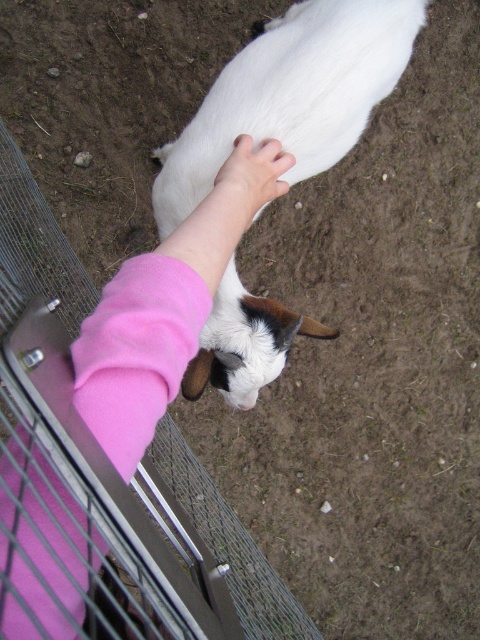
Who is positioned more to the left, pink fleece sleeve at center or pink soft hand at center?

pink fleece sleeve at center

What do you see at coordinates (146, 336) in the screenshot? I see `pink fleece sleeve at center` at bounding box center [146, 336].

Is point (72, 588) positioned behind point (249, 193)?

No, it is in front of (249, 193).

Where is `pink fleece sleeve at center`? The height and width of the screenshot is (640, 480). pink fleece sleeve at center is located at coordinates click(x=146, y=336).

Which of these two, pink fleece sleeve at center or white soft lamb at center, stands shorter?

With less height is pink fleece sleeve at center.

Does pink fleece sleeve at center appear under white soft lamb at center?

Indeed, pink fleece sleeve at center is positioned under white soft lamb at center.

Does point (69, 582) lie in front of point (192, 157)?

Yes, point (69, 582) is in front of point (192, 157).

Locate an element on the screen. The height and width of the screenshot is (640, 480). pink fleece sleeve at center is located at coordinates (146, 336).

Between white soft lamb at center and pink soft hand at center, which one appears on the right side from the viewer's perspective?

white soft lamb at center

Which is above, white soft lamb at center or pink soft hand at center?

white soft lamb at center is above.

Does point (261, 312) lie behind point (203, 204)?

Yes, point (261, 312) is behind point (203, 204).

In order to click on white soft lamb at center in this screenshot , I will do `click(291, 93)`.